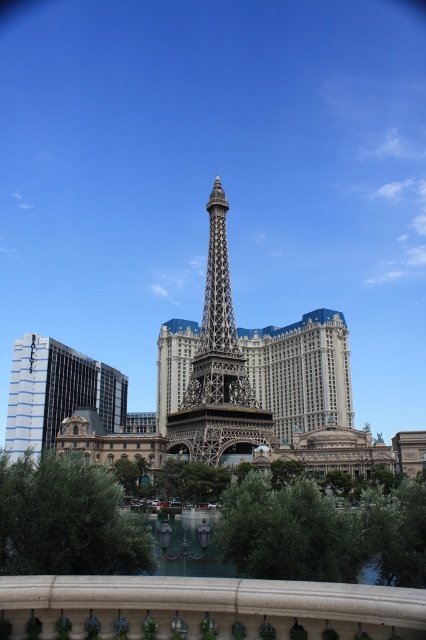
You are an architect designing a new park layout. You need to place a bench between the metallic gold eiffel tower at center and the glassy blue skyscraper at left. Given that the bench requires 2 meters of space, can you fit it between them based on their widths?

The metallic gold eiffel tower at center is narrower than the glassy blue skyscraper at left. However, the description only provides information about their widths, not the distance between them. Without knowing the actual distance between the two structures, it is impossible to determine if the bench can fit.

You are standing at the entrance of the Eiffel Tower replica and notice a white stone balustrade at lower center and a glassy blue skyscraper at left. Which object takes up more area in the scene?

The glassy blue skyscraper at left occupies more space than the white stone balustrade at lower center.